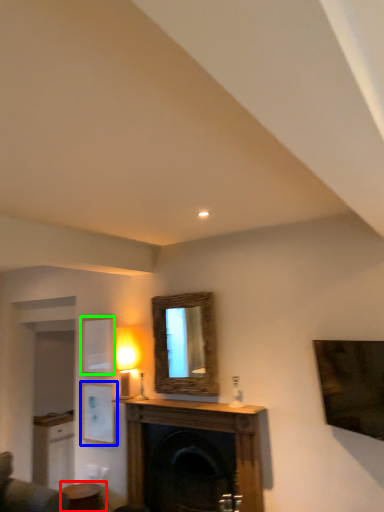
Question: Which is farther away from table (highlighted by a red box)? picture frame (highlighted by a blue box) or picture frame (highlighted by a green box)?

Choices:
 (A) picture frame
 (B) picture frame

Answer: (B)